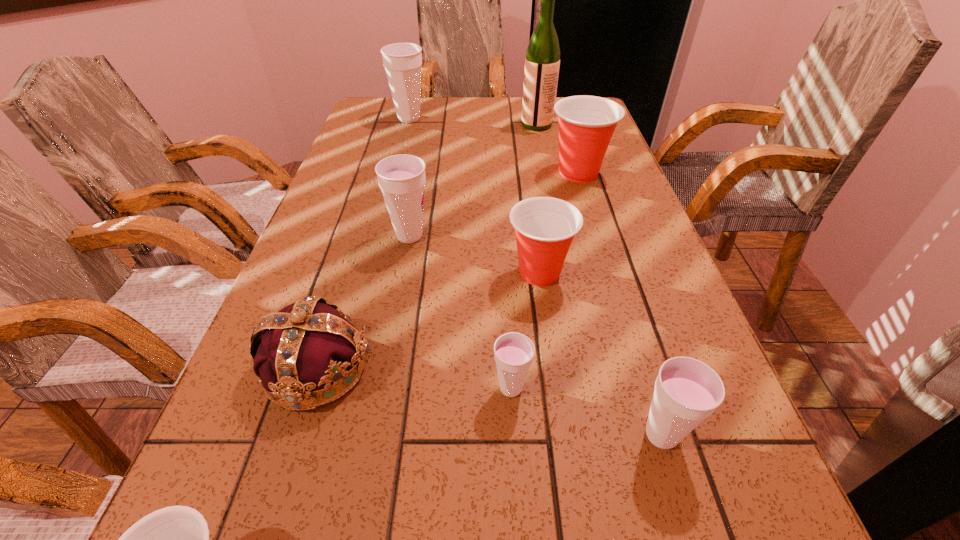
Identify the location of the tallest object. (x=542, y=62).

The image size is (960, 540). Identify the location of liquor. (542, 62).

I want to click on the tallest cup, so click(402, 61).

Where is `the second tallest object`? The width and height of the screenshot is (960, 540). the second tallest object is located at coordinates (402, 61).

The height and width of the screenshot is (540, 960). Identify the location of the third farthest object. (586, 124).

At what (x,y) coordinates should I click in order to perform the action: click on the farthest red cup. Please return your answer as a coordinate pair (x, y). This screenshot has width=960, height=540. Looking at the image, I should click on (586, 124).

The width and height of the screenshot is (960, 540). I want to click on the second biggest purple cup, so click(401, 178).

The width and height of the screenshot is (960, 540). In order to click on the fifth nearest cup in this screenshot , I will do `click(401, 178)`.

What are the coordinates of `purple crown` in the screenshot? It's located at (308, 344).

In order to click on the nearest purple cup in this screenshot , I will do `click(687, 391)`.